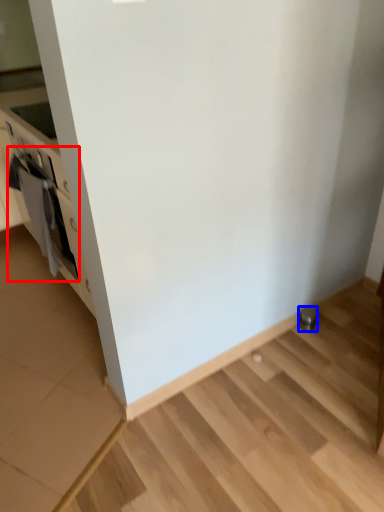
Question: Among these objects, which one is farthest to the camera, oven (highlighted by a red box) or appliance (highlighted by a blue box)?

Choices:
 (A) oven
 (B) appliance

Answer: (B)